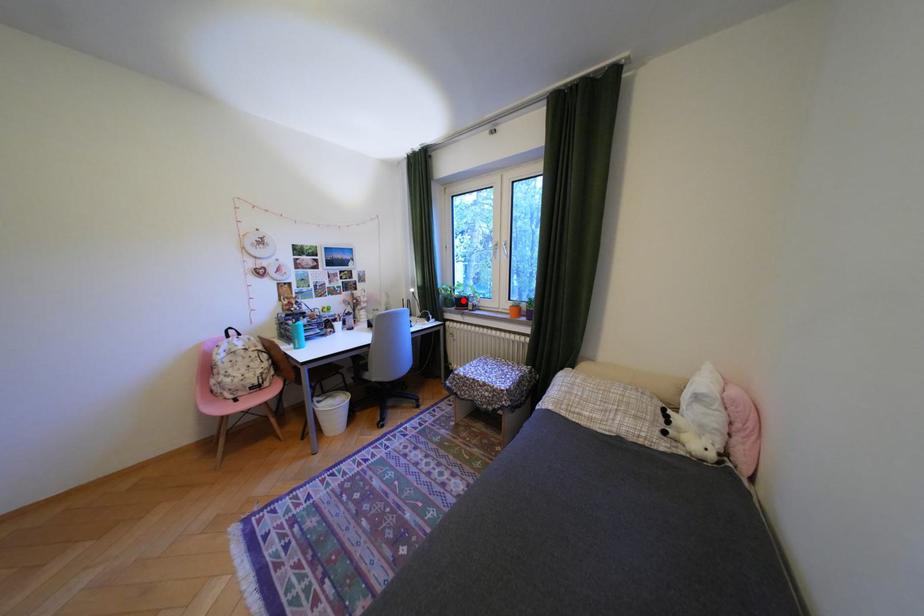
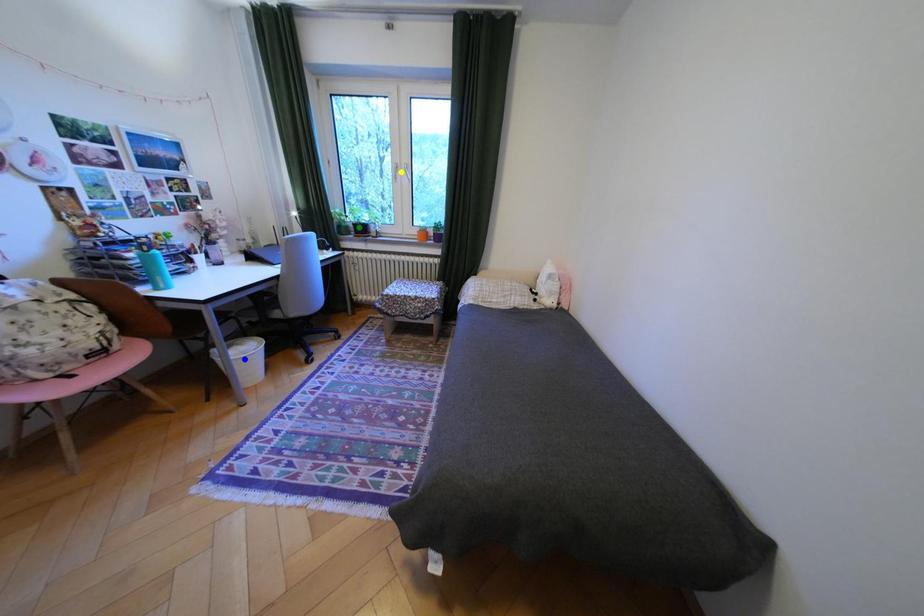
Question: I am providing you with two images of the same scene from different viewpoints. A red point is marked on the first image. You are given multiple points on the second image. Can you choose the point in image 2 that corresponds to the point in image 1?

Choices:
 (A) blue point
 (B) yellow point
 (C) green point

Answer: (C)